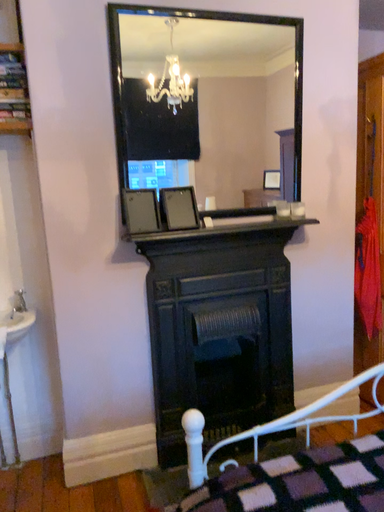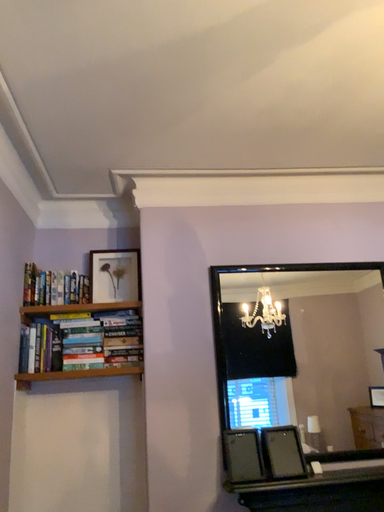
Question: Which way did the camera rotate in the video?

Choices:
 (A) rotated downward
 (B) rotated upward

Answer: (B)